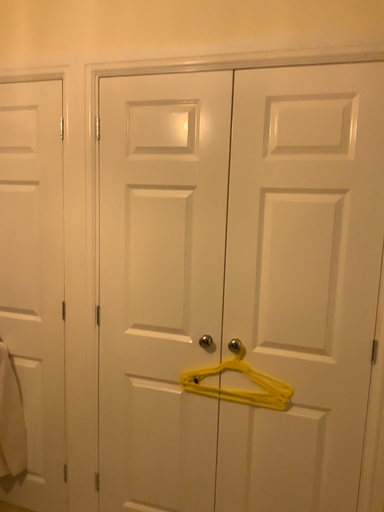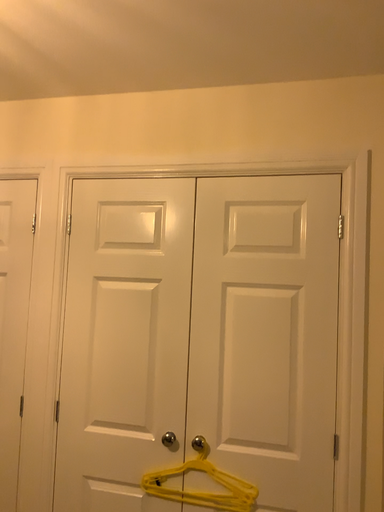
Question: Which way did the camera rotate in the video?

Choices:
 (A) rotated downward
 (B) rotated upward

Answer: (B)